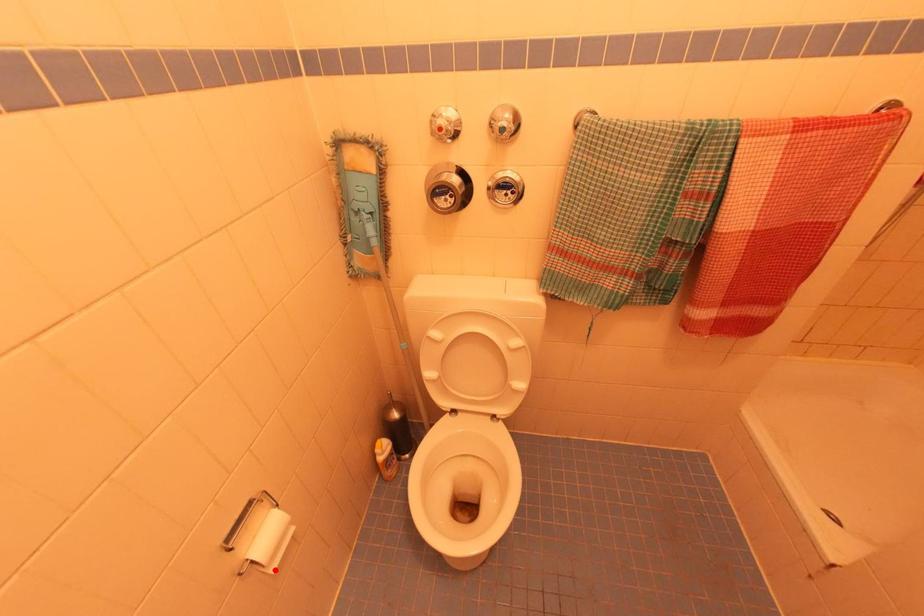
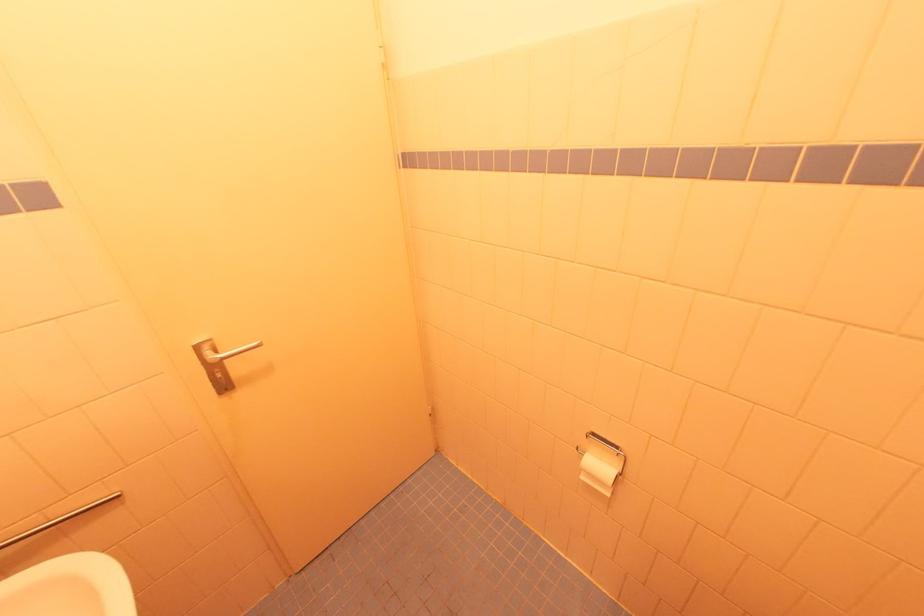
The point at the highlighted location is marked in the first image. Where is the corresponding point in the second image?

(585, 479)